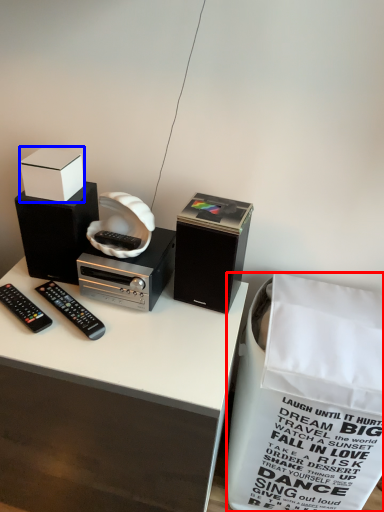
Question: Which object is further to the camera taking this photo, shopping bag (highlighted by a red box) or box (highlighted by a blue box)?

Choices:
 (A) shopping bag
 (B) box

Answer: (B)